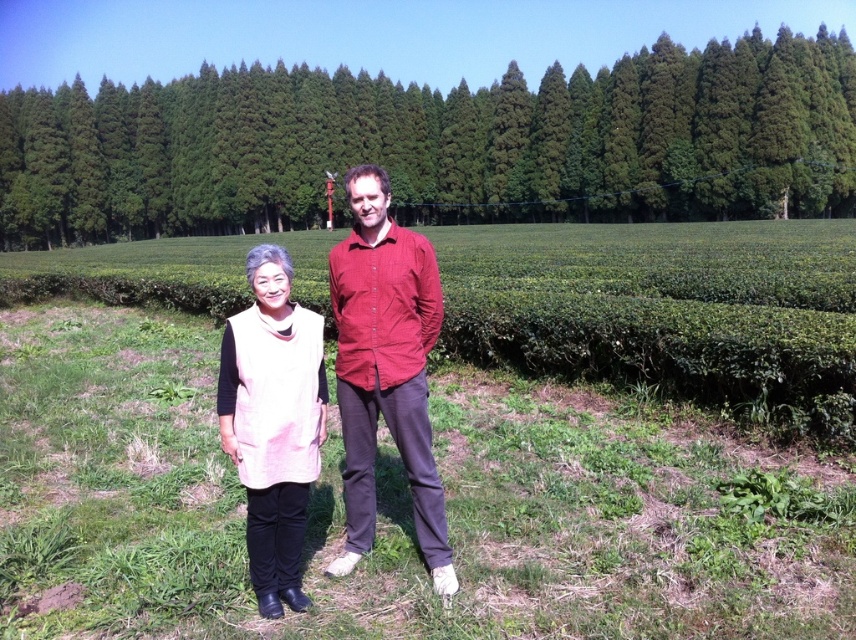
Does green leafy vineyard at center have a larger size compared to matte red shirt at center?

Yes.

Is green leafy vineyard at center closer to the viewer compared to matte red shirt at center?

That is True.

Measure the distance between green leafy vineyard at center and camera.

3.59 meters

I want to click on green leafy vineyard at center, so click(450, 440).

Identify the location of matte red shirt at center. The image size is (856, 640). (385, 368).

What do you see at coordinates (385, 368) in the screenshot? I see `matte red shirt at center` at bounding box center [385, 368].

Is point (421, 248) in front of point (278, 506)?

No, (421, 248) is further to viewer.

Where is `matte red shirt at center`? The height and width of the screenshot is (640, 856). matte red shirt at center is located at coordinates (385, 368).

Which is in front, point (324, 509) or point (646, 93)?

Point (324, 509)

Is green leafy vineyard at center taller than green leafy trees at center?

Incorrect, green leafy vineyard at center's height is not larger of green leafy trees at center's.

Is point (536, 360) positioned behind point (571, 157)?

No, (536, 360) is closer to viewer.

In order to click on green leafy vineyard at center in this screenshot , I will do `click(450, 440)`.